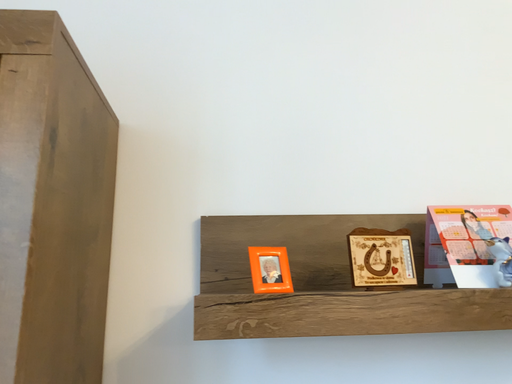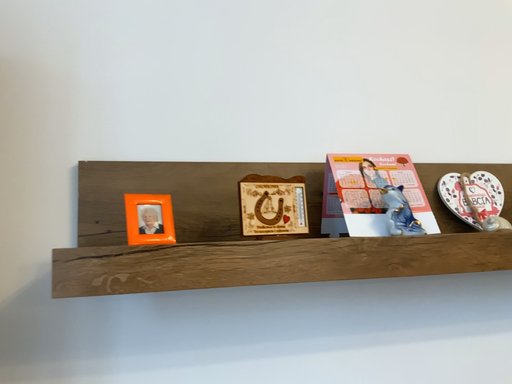
Question: Which way did the camera rotate in the video?

Choices:
 (A) rotated right
 (B) rotated left

Answer: (A)